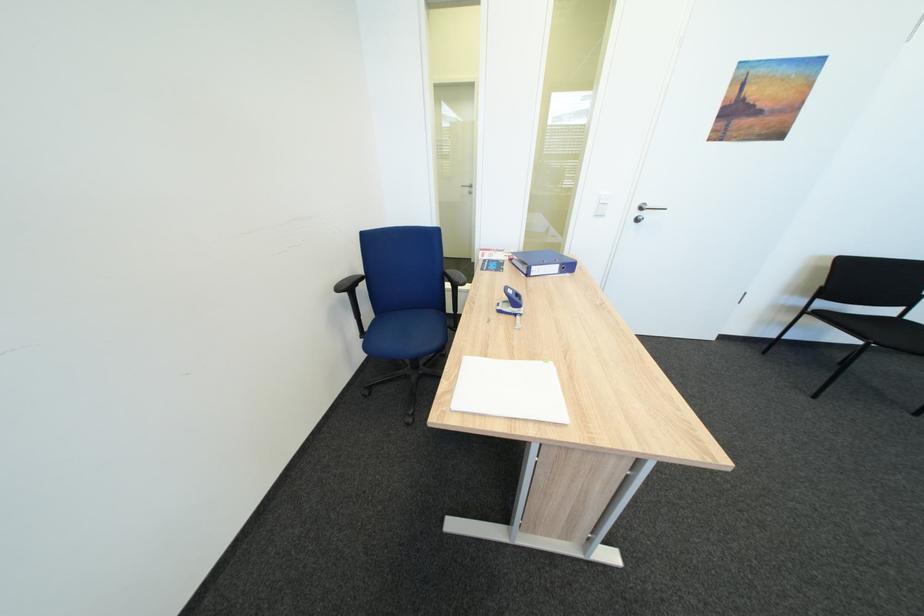
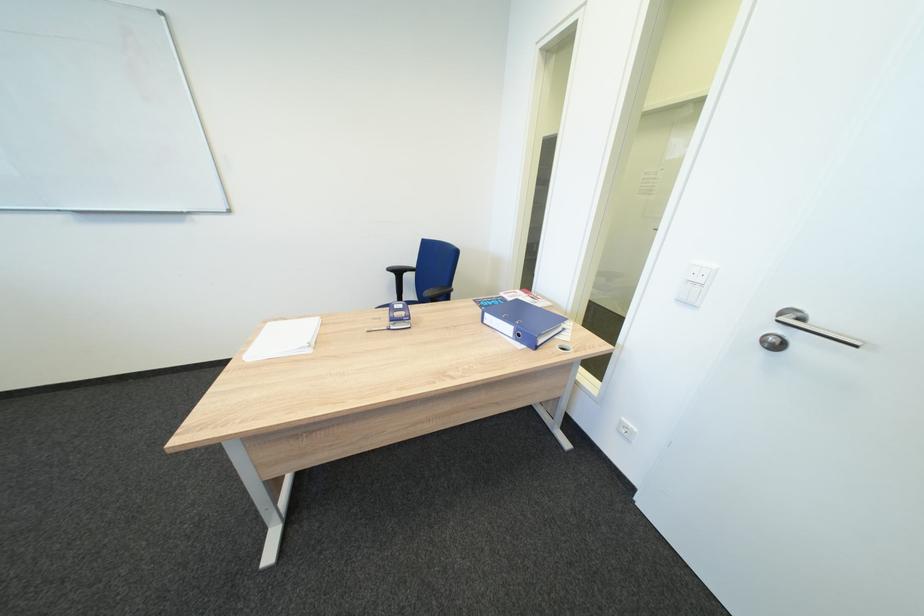
Find the pixel in the second image that matches point 541,276 in the first image.

(495, 323)